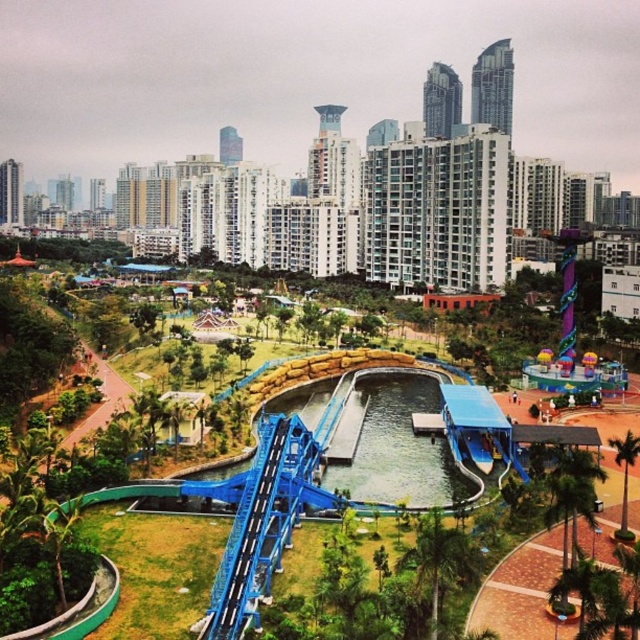
Is point (275, 561) positioned behind point (621, 512)?

No, it is in front of (621, 512).

Measure the distance between blue glossy water slide at center and camera.

The distance of blue glossy water slide at center from camera is 211.99 feet.

You are a GUI agent. You are given a task and a screenshot of the screen. Output one action in this format:
    pyautogui.click(x=<x>, y=<y>)
    Task: Click on the blue glossy water slide at center
    This screenshot has height=640, width=640.
    Given the screenshot: What is the action you would take?
    pyautogui.click(x=253, y=515)

Is blue glossy water slide at center to the left of green leafy palm tree at center from the viewer's perspective?

A: Correct, you'll find blue glossy water slide at center to the left of green leafy palm tree at center.

Is point (298, 496) closer to camera compared to point (467, 563)?

No, it is behind (467, 563).

Does point (259, 534) come farther from viewer compared to point (444, 572)?

Yes, point (259, 534) is farther from viewer.

Locate an element on the screen. The width and height of the screenshot is (640, 640). blue glossy water slide at center is located at coordinates (253, 515).

Between green leafy palm tree at center and green leafy palm tree at lower right, which one is positioned higher?

green leafy palm tree at lower right is above.

Find the location of a particular element. green leafy palm tree at center is located at coordinates (440, 563).